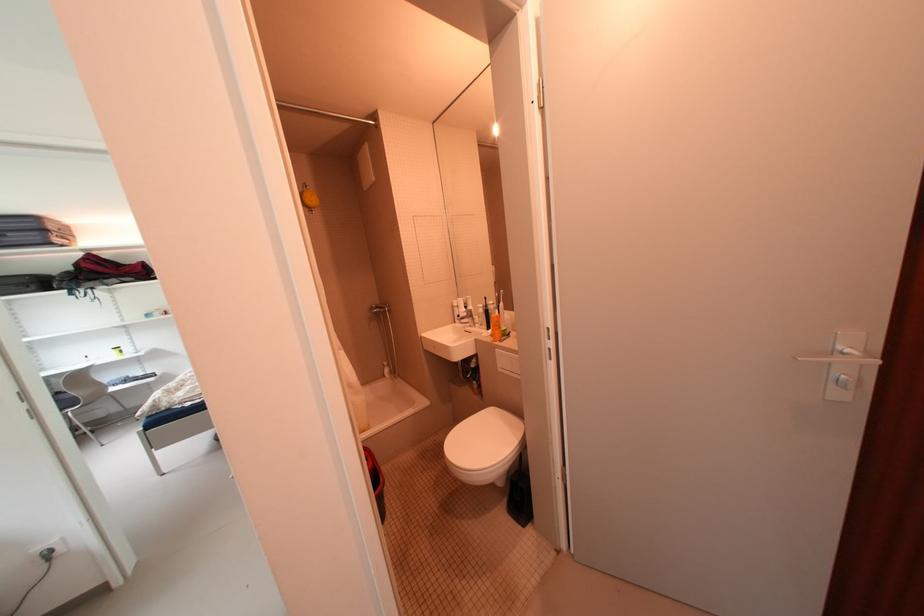
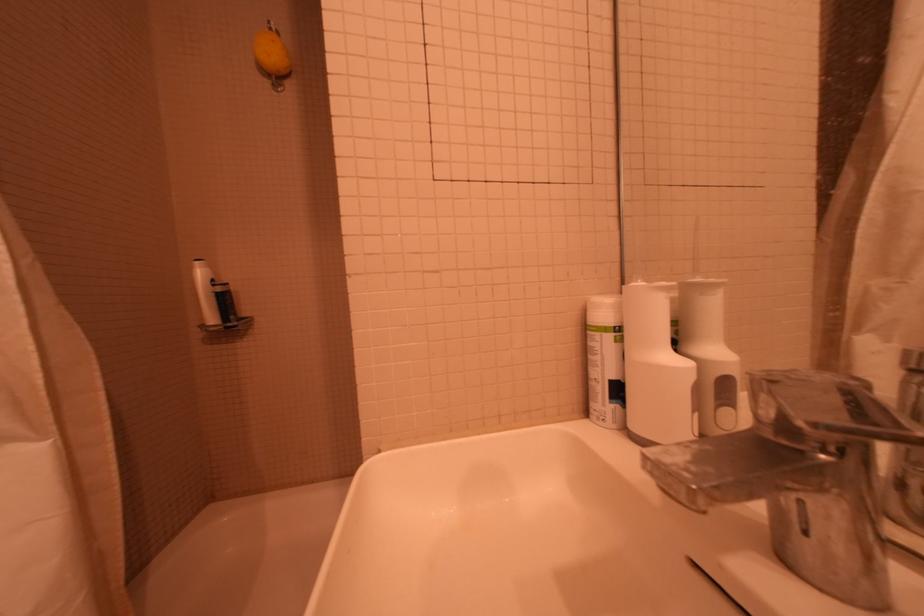
The point at (466, 304) is marked in the first image. Where is the corresponding point in the second image?

(627, 309)